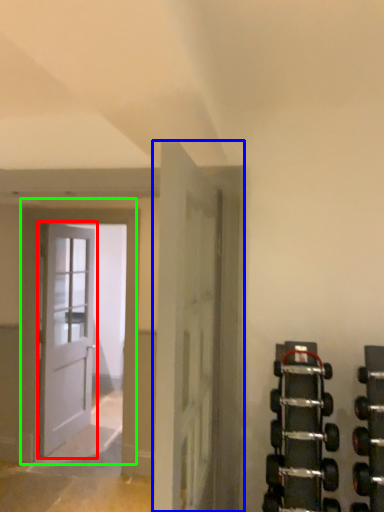
Question: Which object is the closest to the door (highlighted by a red box)? Choose among these: door (highlighted by a blue box) or door (highlighted by a green box).

Choices:
 (A) door
 (B) door

Answer: (B)